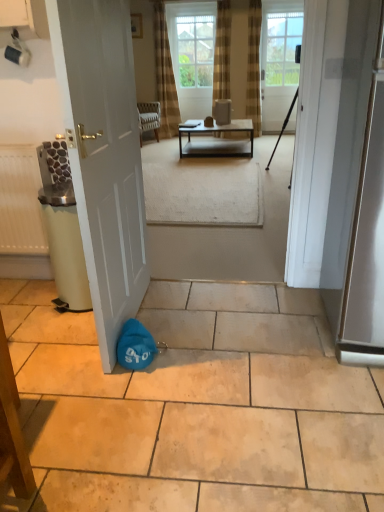
In order to face white matte door at left, the 1th door in the left-to-right sequence, should I rotate leftwards or rightwards?

Rotate your view left by about 10.606°.

What do you see at coordinates (195, 50) in the screenshot? I see `clear glass window screen at upper center` at bounding box center [195, 50].

Describe the element at coordinates (367, 238) in the screenshot. I see `metallic silver screen door at right` at that location.

Where is `white matte door at left, marked as the 2th door in a back-to-front arrangement`? white matte door at left, marked as the 2th door in a back-to-front arrangement is located at coordinates (104, 156).

Would you consider matte blue bag at lower left to be distant from clear glass window screen at upper center?

Yes, matte blue bag at lower left is far from clear glass window screen at upper center.

Is matte blue bag at lower left turned away from clear glass window screen at upper center?

No, matte blue bag at lower left's orientation is not away from clear glass window screen at upper center.

In the scene shown: Would you say matte blue bag at lower left is outside clear glass window screen at upper center?

Yes, matte blue bag at lower left is not within clear glass window screen at upper center.

Is matte blue bag at lower left smaller than clear glass window screen at upper center?

Incorrect, matte blue bag at lower left is not smaller in size than clear glass window screen at upper center.

Is white glass door at upper center, the 2th door ordered from the bottom, positioned behind matte blue bag at lower left?

Yes.

Does white glass door at upper center, which appears as the 1th door when viewed from the back, touch matte blue bag at lower left?

No, white glass door at upper center, which appears as the 1th door when viewed from the back, is not next to matte blue bag at lower left.

How many degrees apart are the facing directions of white glass door at upper center, acting as the first door starting from the top, and matte blue bag at lower left?

There is a 180-degree angle between the facing directions of white glass door at upper center, acting as the first door starting from the top, and matte blue bag at lower left.

From the picture: From a real-world perspective, is brown textured curtain at upper center below metallic black table at center?

No, from a real-world perspective, brown textured curtain at upper center is not beneath metallic black table at center.

Considering the sizes of objects brown textured curtain at upper center and metallic black table at center in the image provided, who is bigger, brown textured curtain at upper center or metallic black table at center?

metallic black table at center.

Which object is more forward, brown textured curtain at upper center or metallic black table at center?

metallic black table at center is more forward.

Is white matte door at left, positioned as the first door in bottom-to-top order, oriented towards white glass door at upper center, which is counted as the 1th door, starting from the right?

No, white matte door at left, positioned as the first door in bottom-to-top order, is not facing towards white glass door at upper center, which is counted as the 1th door, starting from the right.

Is white matte door at left, which ranks as the 2th door in right-to-left order, not near white glass door at upper center, the 2th door ordered from the bottom?

Indeed, white matte door at left, which ranks as the 2th door in right-to-left order, is not near white glass door at upper center, the 2th door ordered from the bottom.

Is point (90, 64) in front of point (298, 38)?

That is True.

Which is behind, white matte door at left, positioned as the first door in bottom-to-top order, or white glass door at upper center, acting as the second door starting from the front?

white glass door at upper center, acting as the second door starting from the front, is further from the camera.

The image size is (384, 512). In order to click on door located on the right of matte blue bag at lower left in this screenshot , I will do `click(279, 59)`.

Consider the image. Considering the sizes of objects matte blue bag at lower left and white glass door at upper center, which is counted as the 1th door, starting from the right, in the image provided, who is taller, matte blue bag at lower left or white glass door at upper center, which is counted as the 1th door, starting from the right,?

Standing taller between the two is white glass door at upper center, which is counted as the 1th door, starting from the right.

What's the angular difference between matte blue bag at lower left and white glass door at upper center, acting as the second door starting from the front,'s facing directions?

180 degrees.

In the image, is matte blue bag at lower left positioned in front of or behind white glass door at upper center, acting as the second door starting from the front?

matte blue bag at lower left is in front of white glass door at upper center, acting as the second door starting from the front.

Is point (207, 25) farther from camera compared to point (107, 367)?

Yes, it is behind point (107, 367).

From a real-world perspective, is clear glass window screen at upper center on top of white matte door at left, which is counted as the second door, starting from the top?

Yes.

Is clear glass window screen at upper center directly adjacent to white matte door at left, the first door in the front-to-back sequence?

No, clear glass window screen at upper center is not making contact with white matte door at left, the first door in the front-to-back sequence.

In the image, is clear glass window screen at upper center positioned in front of or behind white matte door at left, which is counted as the second door, starting from the top?

clear glass window screen at upper center is behind white matte door at left, which is counted as the second door, starting from the top.

From the image's perspective, which one is positioned lower, metallic black table at center or white glass door at upper center, which appears as the 1th door when viewed from the back?

metallic black table at center.

Does metallic black table at center have a lesser width compared to white glass door at upper center, the 2th door ordered from the bottom?

No.

Is metallic black table at center facing away from white glass door at upper center, which appears as the 1th door when viewed from the back?

No, white glass door at upper center, which appears as the 1th door when viewed from the back, is not at the back of metallic black table at center.

This screenshot has width=384, height=512. I want to click on door to the right of metallic black table at center, so click(x=279, y=59).

Find the location of a particular element. window screen behind the matte blue bag at lower left is located at coordinates (195, 50).

This screenshot has width=384, height=512. I want to click on door on the right of matte blue bag at lower left, so click(x=279, y=59).

Looking at the image, which one is located further to brown textured curtain at upper center, white glass door at upper center, acting as the second door starting from the left, or metallic silver screen door at right?

The object further to brown textured curtain at upper center is metallic silver screen door at right.

Which object lies further to the anchor point matte white coffee cup at upper left, white glass door at upper center, acting as the second door starting from the front, or metallic black table at center?

Among the two, white glass door at upper center, acting as the second door starting from the front, is located further to matte white coffee cup at upper left.

Considering their positions, is white matte door at left, the 1th door in the left-to-right sequence, positioned further to clear glass window screen at upper center than metallic silver screen door at right?

Among the two, metallic silver screen door at right is located further to clear glass window screen at upper center.

Based on their spatial positions, is clear glass window screen at upper center or brown textured curtain at upper center closer to matte white coffee cup at upper left?

brown textured curtain at upper center is positioned closer to the anchor matte white coffee cup at upper left.

Looking at the image, which one is located closer to white glass door at upper center, acting as the first door starting from the top, metallic black table at center or brown textured curtain at upper center?

Based on the image, metallic black table at center appears to be nearer to white glass door at upper center, acting as the first door starting from the top.

Based on their spatial positions, is metallic black table at center or metallic silver screen door at right closer to brown textured curtain at upper center?

Among the two, metallic black table at center is located nearer to brown textured curtain at upper center.

Estimate the real-world distances between objects in this image. Which object is closer to metallic silver screen door at right, matte white radiator at left or metallic black table at center?

Among the two, matte white radiator at left is located nearer to metallic silver screen door at right.

Estimate the real-world distances between objects in this image. Which object is further from clear glass window screen at upper center, matte white coffee cup at upper left or metallic black table at center?

Based on the image, matte white coffee cup at upper left appears to be further to clear glass window screen at upper center.

Where is `table between matte white radiator at left and white glass door at upper center, which is counted as the 1th door, starting from the right, from front to back`? The image size is (384, 512). table between matte white radiator at left and white glass door at upper center, which is counted as the 1th door, starting from the right, from front to back is located at coordinates (217, 141).

This screenshot has height=512, width=384. What are the coordinates of `curtain between matte blue bag at lower left and white glass door at upper center, which appears as the 1th door when viewed from the back, from front to back` in the screenshot? It's located at (165, 75).

Image resolution: width=384 pixels, height=512 pixels. I want to click on door located between matte blue bag at lower left and brown textured curtain at upper center in the depth direction, so click(104, 156).

What are the coordinates of `radiator between matte blue bag at lower left and brown textured curtain at upper center along the z-axis` in the screenshot? It's located at (20, 202).